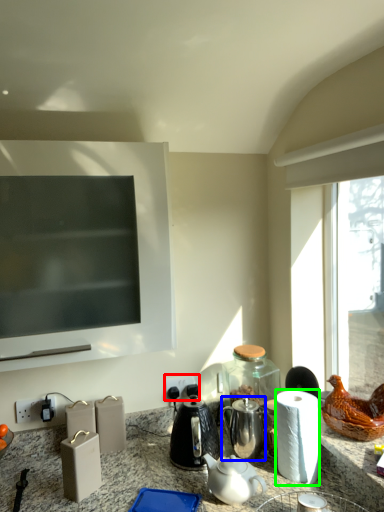
Question: Which object is positioned farthest from electric outlet (highlighted by a red box)? Select from tea pot (highlighted by a blue box) and paper towel (highlighted by a green box).

Choices:
 (A) tea pot
 (B) paper towel

Answer: (B)